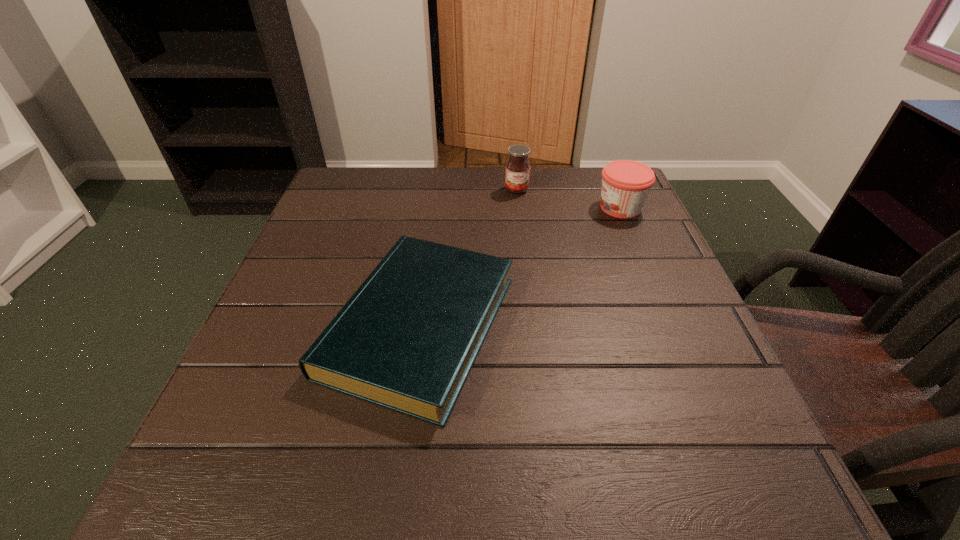
At what (x,y) coordinates should I click in order to perform the action: click on vacant region that satisfies the following two spatial constraints: 1. on the front label of the rightmost object; 2. on the front side of the nearest object. Please return your answer as a coordinate pair (x, y). The image size is (960, 540). Looking at the image, I should click on (671, 326).